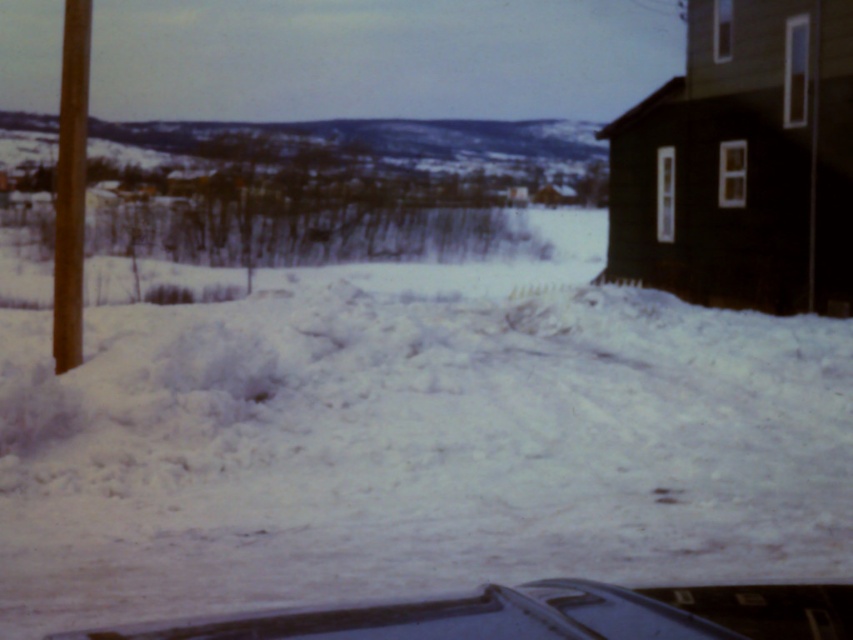
Who is more forward, (759, 611) or (80, 10)?

Point (759, 611) is more forward.

How distant is shiny black car at lower center from brown wooden pole at left?

They are 11.78 meters apart.

At what (x,y) coordinates should I click in order to perform the action: click on shiny black car at lower center. Please return your answer as a coordinate pair (x, y). Looking at the image, I should click on (544, 616).

Does white fluffy snow at center have a greater width compared to shiny black car at lower center?

Indeed, white fluffy snow at center has a greater width compared to shiny black car at lower center.

Can you confirm if white fluffy snow at center is smaller than shiny black car at lower center?

Incorrect, white fluffy snow at center is not smaller in size than shiny black car at lower center.

Does point (320, 550) lie in front of point (670, 621)?

No.

The height and width of the screenshot is (640, 853). In order to click on white fluffy snow at center in this screenshot , I will do `click(415, 440)`.

Who is lower down, white fluffy snow at center or brown wooden pole at left?

white fluffy snow at center is below.

The image size is (853, 640). Describe the element at coordinates (415, 440) in the screenshot. I see `white fluffy snow at center` at that location.

Between point (166, 352) and point (67, 266), which one is positioned behind?

Point (67, 266)

Find the location of a particular element. The width and height of the screenshot is (853, 640). white fluffy snow at center is located at coordinates (415, 440).